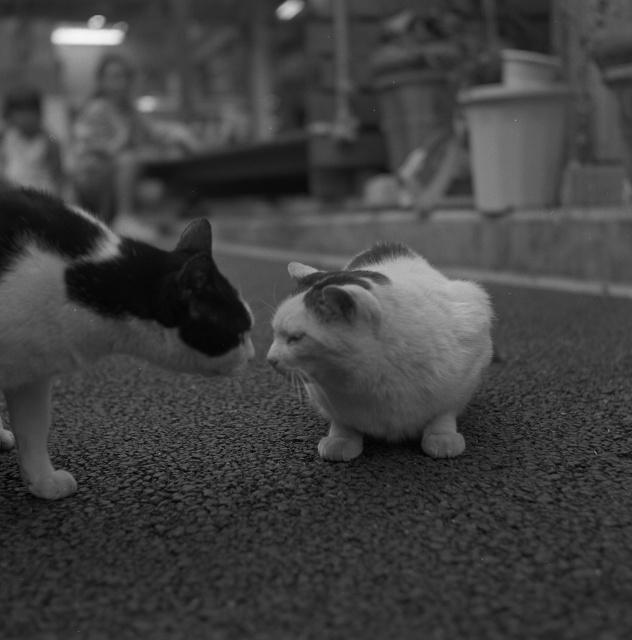
Question: Is black and white fur cat at left to the right of fluffy white cat at center from the viewer's perspective?

Choices:
 (A) no
 (B) yes

Answer: (A)

Question: Which of the following is the farthest from the observer?

Choices:
 (A) (454, 308)
 (B) (1, 356)

Answer: (A)

Question: Is black and white fur cat at left below fluffy white cat at center?

Choices:
 (A) no
 (B) yes

Answer: (A)

Question: Is black and white fur cat at left positioned in front of fluffy white cat at center?

Choices:
 (A) no
 (B) yes

Answer: (B)

Question: Among these objects, which one is nearest to the camera?

Choices:
 (A) black and white fur cat at left
 (B) fluffy white cat at center

Answer: (A)